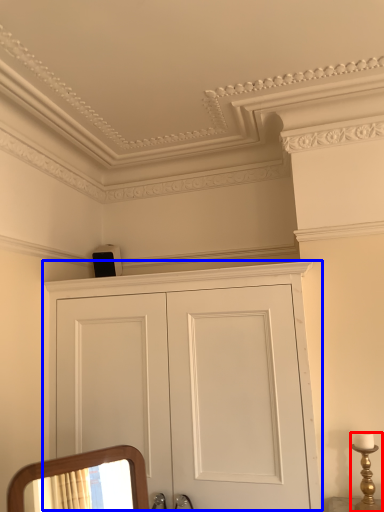
Question: Which point is closer to the camera, candle holder (highlighted by a red box) or cupboard (highlighted by a blue box)?

Choices:
 (A) candle holder
 (B) cupboard

Answer: (B)